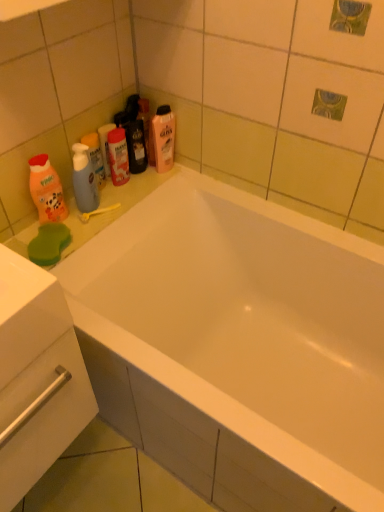
Question: In terms of size, does translucent plastic bottle at upper center, which appears as the first cleaning product when viewed from the right, appear bigger or smaller than translucent plastic mouthwash at upper center, marked as the second mouthwash in a left-to-right arrangement?

Choices:
 (A) big
 (B) small

Answer: (A)

Question: Relative to translucent plastic mouthwash at upper center, marked as the first mouthwash in a right-to-left arrangement, is translucent plastic bottle at upper center, acting as the first cleaning product starting from the top, in front or behind?

Choices:
 (A) front
 (B) behind

Answer: (B)

Question: Which of these objects is positioned farthest from the yellow plastic toothbrush at upper left?

Choices:
 (A) translucent plastic bottle at upper center, the 2th cleaning product when ordered from left to right
 (B) translucent plastic mouthwash at upper center, marked as the first mouthwash in a right-to-left arrangement
 (C) white glossy drawer at lower left
 (D) translucent plastic mouthwash at upper left, which is the second mouthwash from right to left
 (E) orange matte bottle at left, placed as the 1th cleaning product when sorted from left to right

Answer: (C)

Question: Estimate the real-world distances between objects in this image. Which object is farther from the translucent plastic mouthwash at upper center, marked as the first mouthwash in a right-to-left arrangement?

Choices:
 (A) translucent plastic bottle at upper center, placed as the second cleaning product when sorted from bottom to top
 (B) yellow plastic toothbrush at upper left
 (C) orange matte bottle at left, the 2th cleaning product from the top
 (D) translucent plastic mouthwash at upper left, which appears as the first mouthwash when viewed from the left
 (E) white glossy drawer at lower left

Answer: (E)